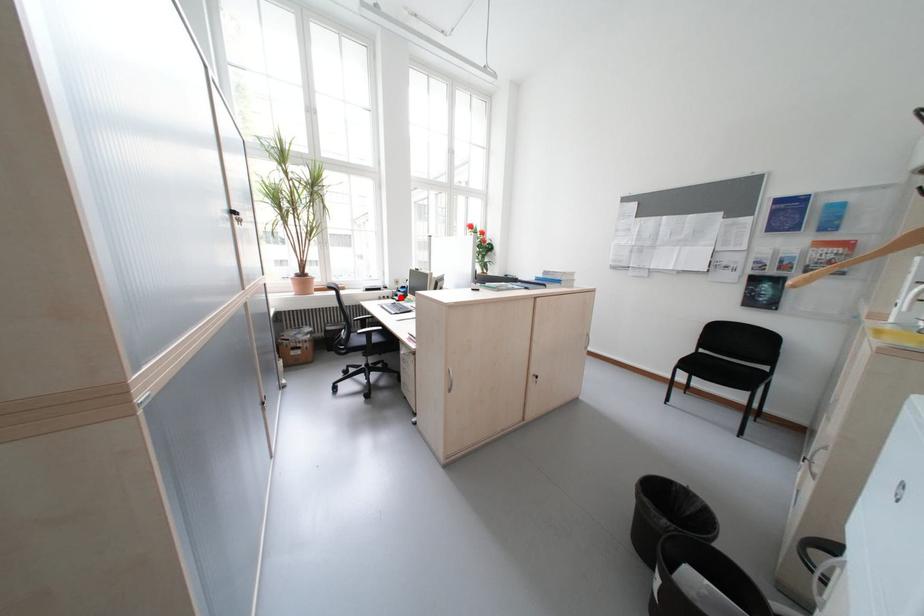
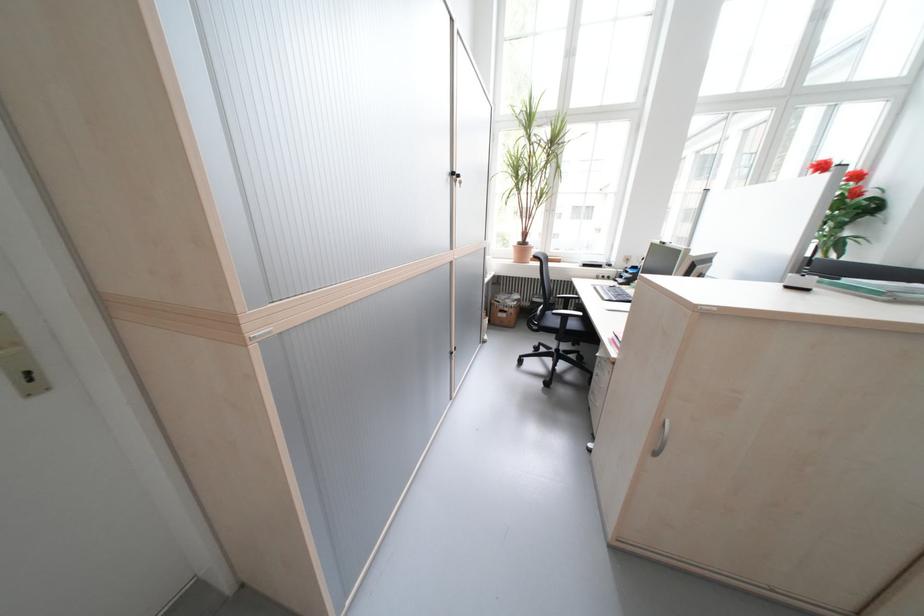
Find the pixel in the second image that matches the highlighted location in the first image.

(623, 278)